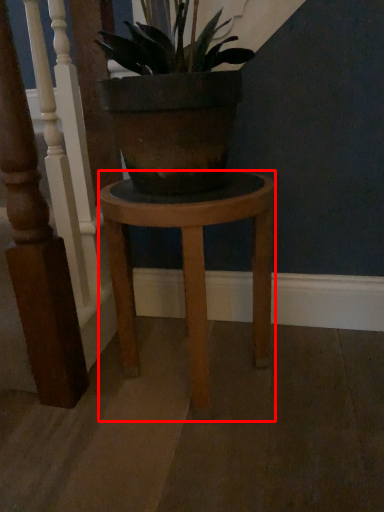
Question: From the image's perspective, considering the relative positions of stool (annotated by the red box) and rail in the image provided, where is stool (annotated by the red box) located with respect to the staircase?

Choices:
 (A) above
 (B) below

Answer: (B)